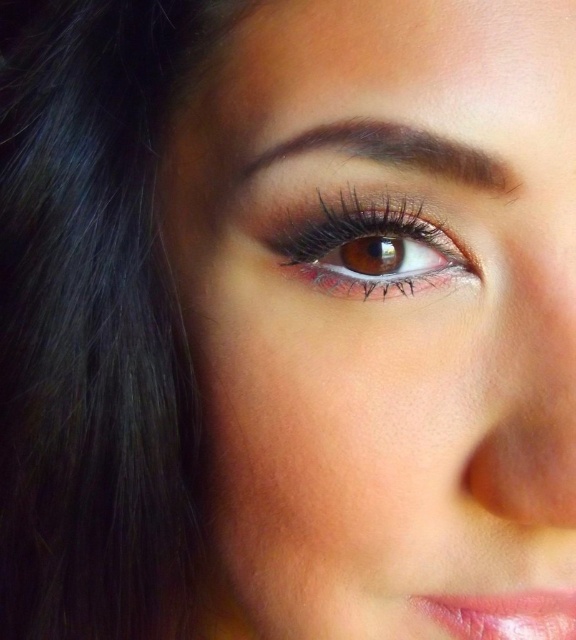
You are a makeup artist preparing to apply eyeliner on the brown matte eye at center and lipstick on the shiny pink lipstick at lower right. Considering their sizes, which area requires more precise application technique?

The brown matte eye at center requires more precise application technique because its width is larger than the shiny pink lipstick at lower right, making it more challenging to achieve a clean and even finish.

Consider the image. Based on the scene description, which object is taller between the brown matte eye at center and the dark brown matte eyebrow at upper center?

The brown matte eye at center is much taller than the dark brown matte eyebrow at upper center according to the description.

You are a photographer adjusting the focus on a camera. The subject has a point at coordinates point (342, 280). If the camera lens can only focus on objects within a 10 inch radius, will it be able to focus on the point?

The point is 11.06 inches away, which is beyond the 10 inch radius, so the camera lens cannot focus on it.